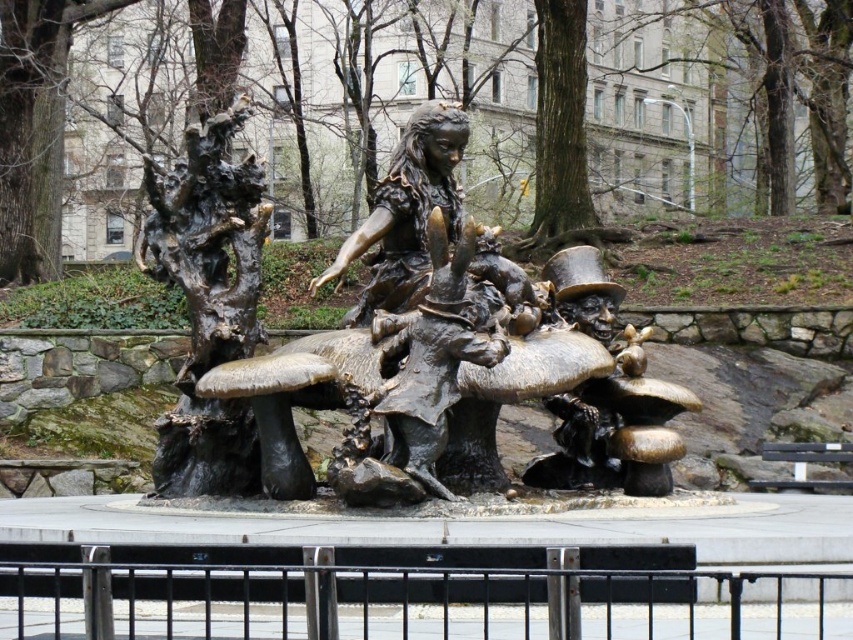
Question: Which point is closer to the camera taking this photo?

Choices:
 (A) (473, 188)
 (B) (618, 483)

Answer: (B)

Question: Which object appears closest to the camera in this image?

Choices:
 (A) bronze textured tree at center
 (B) bronze/metallic figure at center

Answer: (B)

Question: In this image, where is bronze textured tree at center located relative to bronze/metallic figure at center?

Choices:
 (A) right
 (B) left

Answer: (B)

Question: Is bronze textured tree at center bigger than bronze/metallic figure at center?

Choices:
 (A) yes
 (B) no

Answer: (A)

Question: Does bronze textured tree at center appear under bronze/metallic figure at center?

Choices:
 (A) yes
 (B) no

Answer: (B)